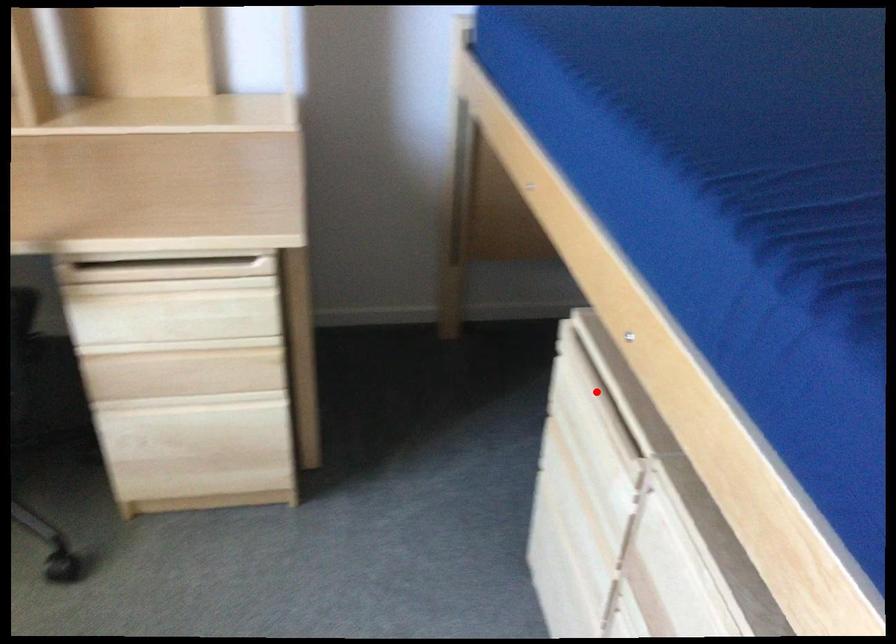
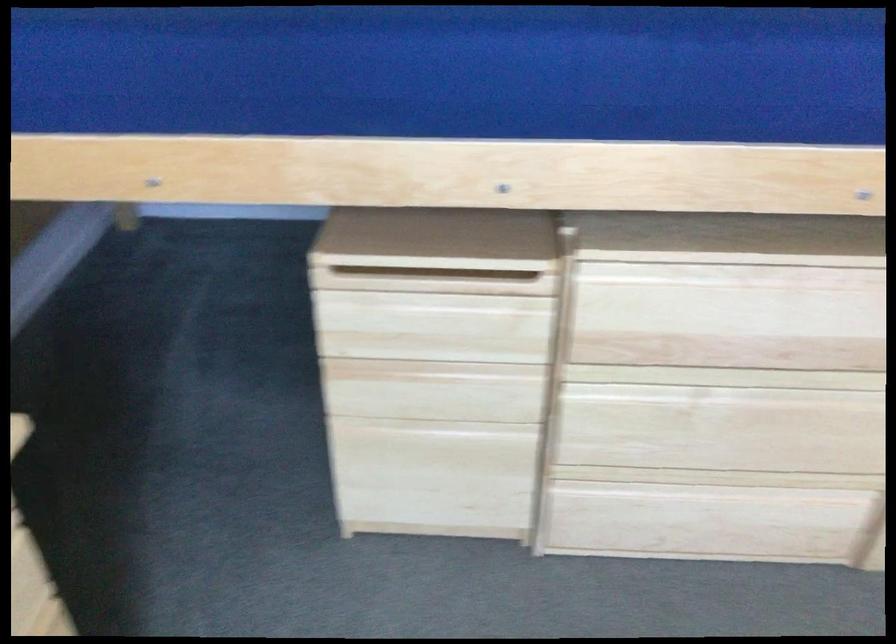
Where in the second image is the point corresponding to the highlighted location from the first image?

(432, 279)